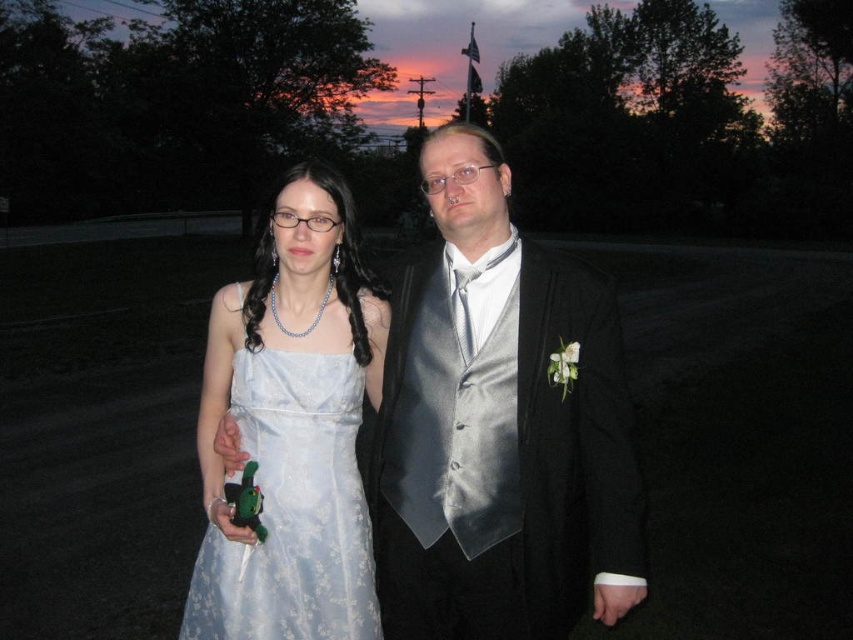
Which of these two, satin dress at center or satin dress at left, stands taller?

satin dress at center

Does point (399, 440) lie behind point (312, 396)?

Yes, it is.

Which is behind, point (451, 628) or point (271, 214)?

The point (271, 214) is behind.

Find the location of a particular element. This screenshot has height=640, width=853. satin dress at center is located at coordinates pos(498,426).